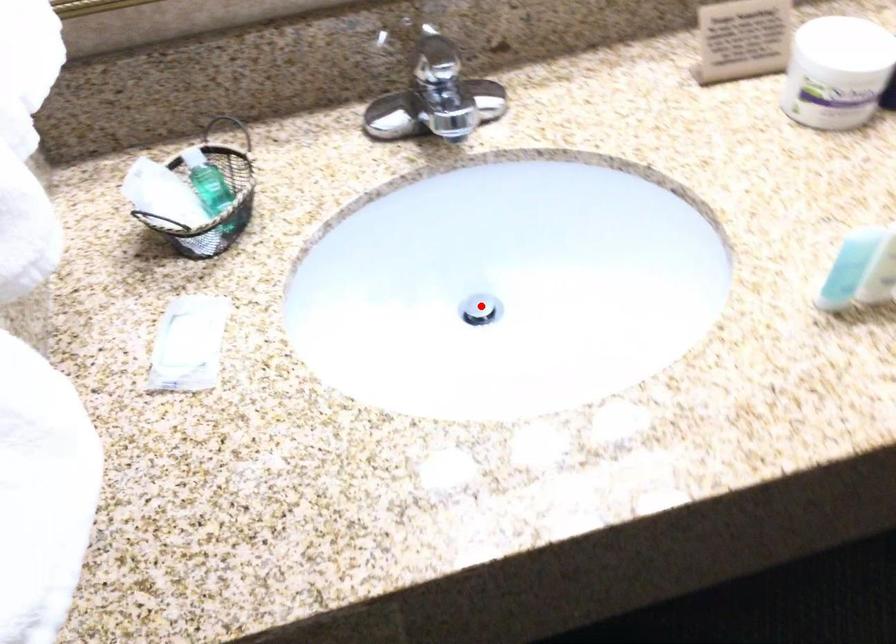
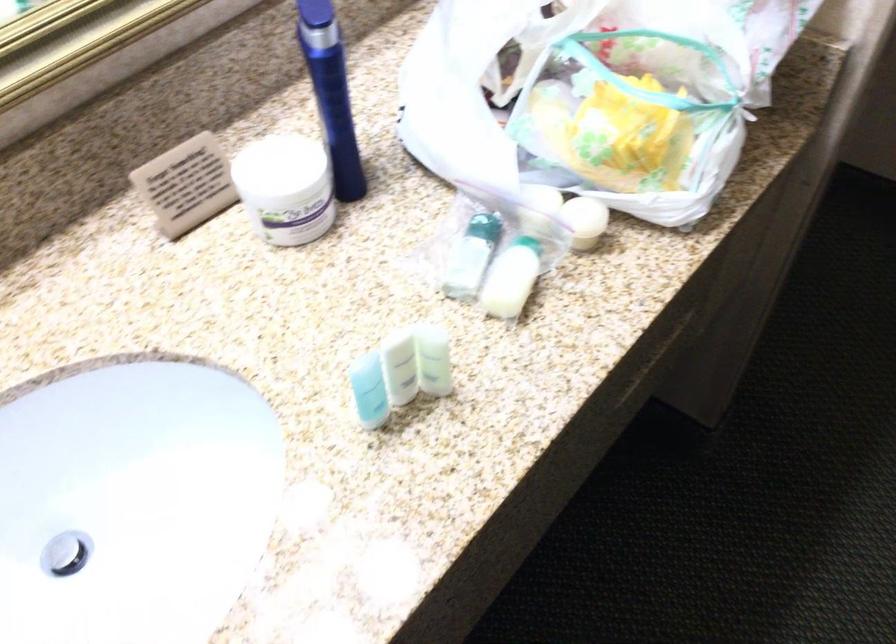
Locate, in the second image, the point that corresponds to the highlighted location in the first image.

(65, 554)